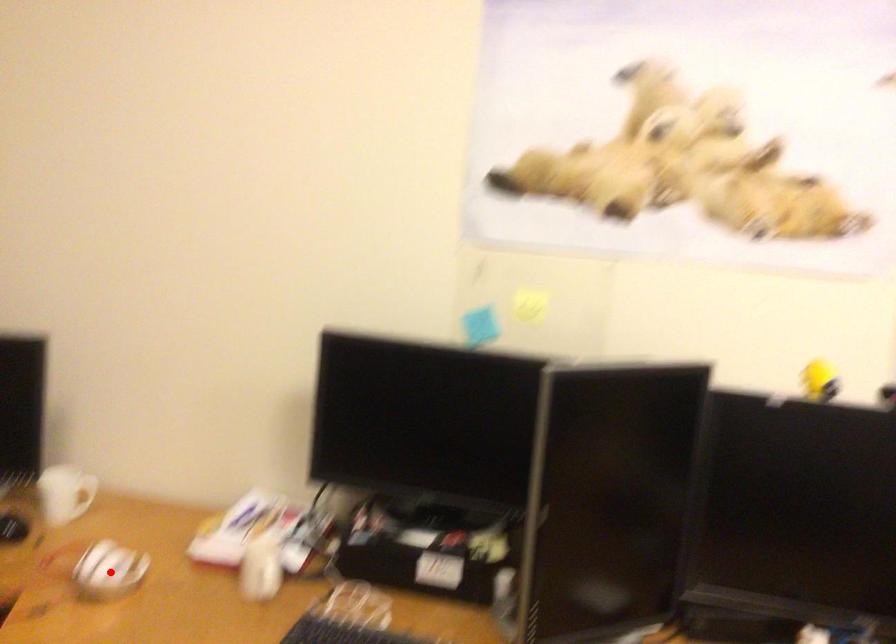
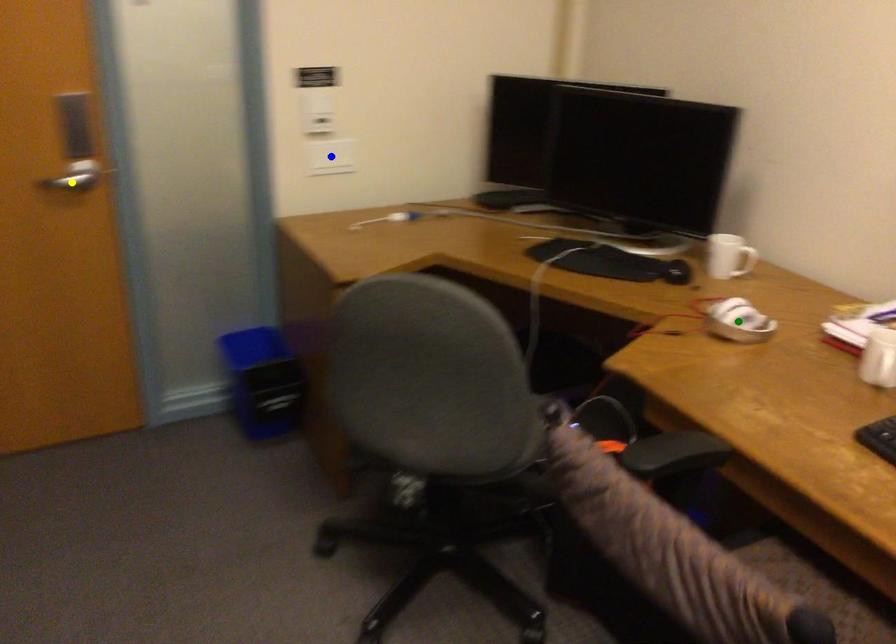
Question: I am providing you with two images of the same scene from different viewpoints. A red point is marked on the first image. You are given multiple points on the second image. Which mark in image 2 goes with the point in image 1?

Choices:
 (A) yellow point
 (B) green point
 (C) blue point

Answer: (B)